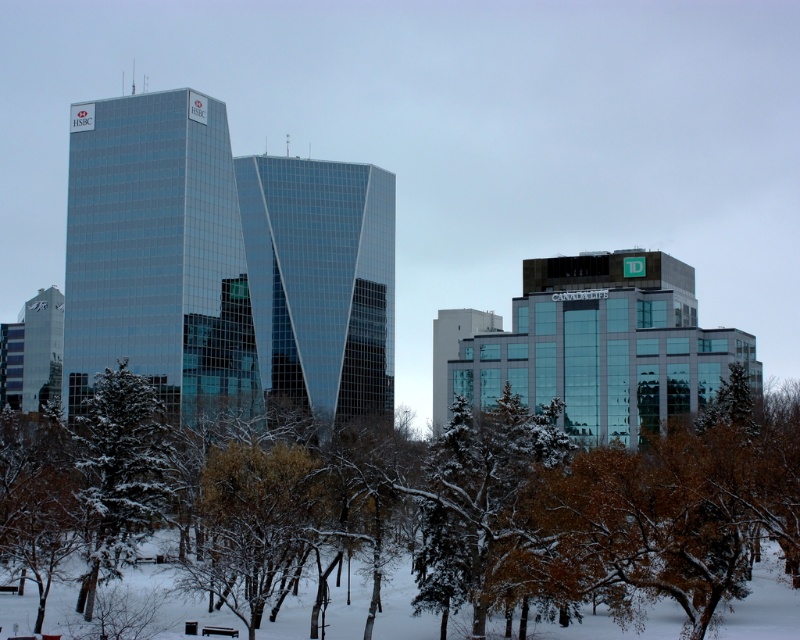
You are standing at the center of the snowy landscape and need to locate the green matte tree at lower left. Based on its coordinates, in which direction should you move to reach it?

The green matte tree at lower left is located at point (121, 467), which means it is positioned to the left and slightly forward from your current position at the center. You should move towards the lower left direction to reach it.

You are standing at the point marked as point (596, 346) in the image. Looking around, you see the glassy reflective building at center. What is the nearest object to you in this winter scene?

The nearest object to you is the glassy reflective building at center, as you are positioned at point (596, 346) which corresponds to that building.

You are an architect analyzing the urban layout. Based on the scene, which object is positioned higher relative to the other between the glassy reflective building at center and the green matte tree at lower left?

The glassy reflective building at center is located above the green matte tree at lower left, so it is positioned higher.